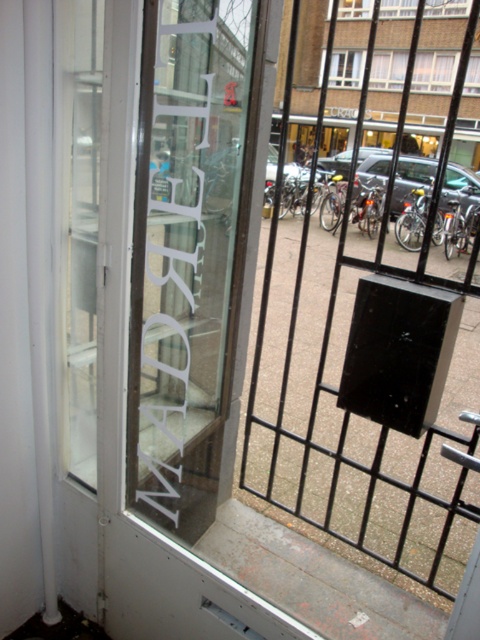
Question: Does transparent glass sign at upper left appear under transparent glass window at center?

Choices:
 (A) no
 (B) yes

Answer: (B)

Question: Is transparent glass door at center positioned behind transparent glass window at center?

Choices:
 (A) yes
 (B) no

Answer: (B)

Question: Which object is farther from the camera taking this photo?

Choices:
 (A) white plastic window at upper center
 (B) transparent glass window at center

Answer: (A)

Question: Which point is closer to the camera taking this photo?

Choices:
 (A) (362, 342)
 (B) (403, 81)
 (C) (156, 378)

Answer: (C)

Question: Is the position of white plastic window at upper center more distant than that of transparent glass window at center?

Choices:
 (A) yes
 (B) no

Answer: (A)

Question: Among these objects, which one is farthest from the camera?

Choices:
 (A) transparent glass door at center
 (B) transparent glass sign at upper left

Answer: (B)